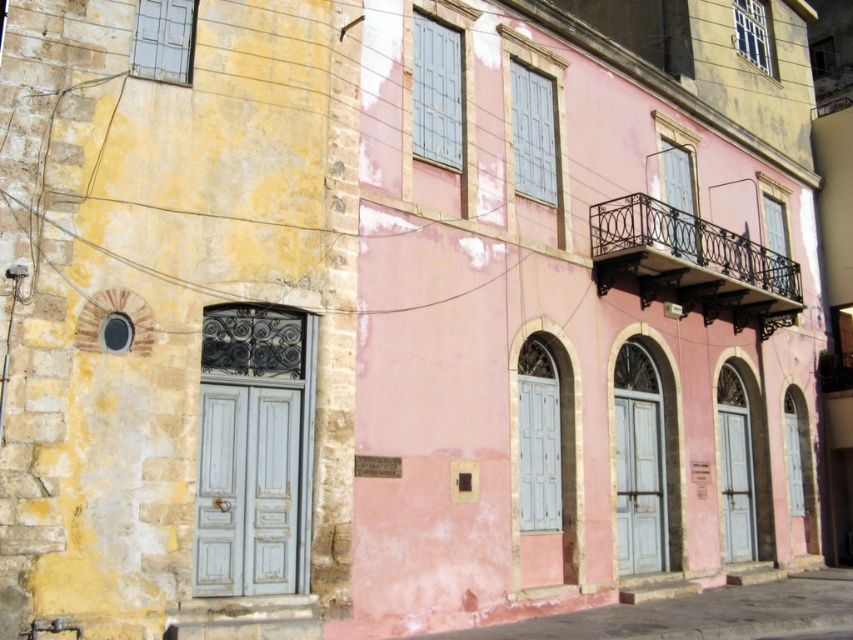
Is matte blue door at center taller than matte gray door at lower right?

Incorrect, matte blue door at center's height is not larger of matte gray door at lower right's.

Can you confirm if matte blue door at center is positioned to the left of matte gray door at lower right?

Indeed, matte blue door at center is positioned on the left side of matte gray door at lower right.

Locate an element on the screen. The width and height of the screenshot is (853, 640). matte blue door at center is located at coordinates (639, 483).

Who is taller, distressed white door at left or matte gray door at lower right?

With more height is matte gray door at lower right.

Does distressed white door at left have a larger size compared to matte gray door at lower right?

No.

The image size is (853, 640). In order to click on distressed white door at left in this screenshot , I will do `click(247, 490)`.

Image resolution: width=853 pixels, height=640 pixels. Find the location of `distressed white door at left`. distressed white door at left is located at coordinates (247, 490).

Is distressed white door at left to the right of matte blue door at center from the viewer's perspective?

No, distressed white door at left is not to the right of matte blue door at center.

Where is `distressed white door at left`? The image size is (853, 640). distressed white door at left is located at coordinates (247, 490).